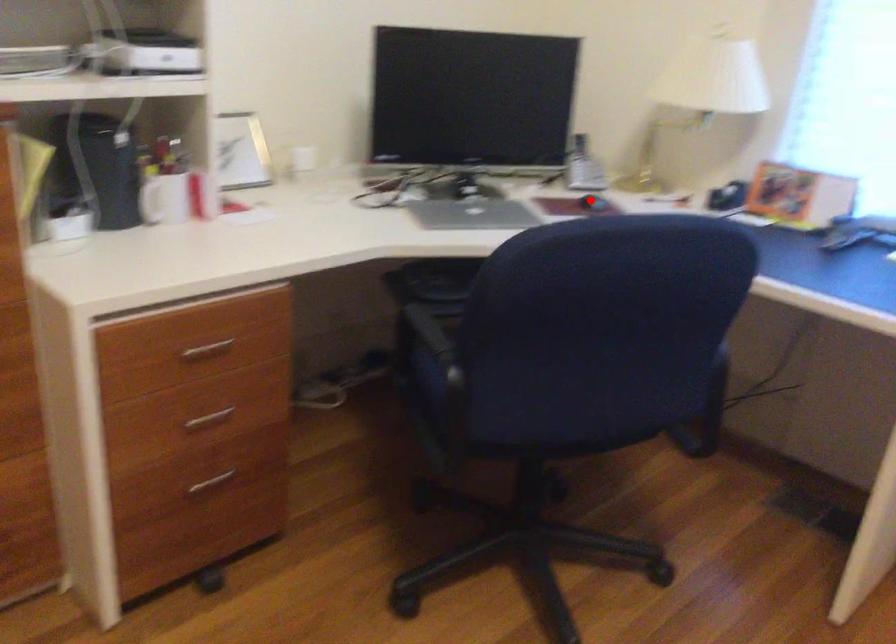
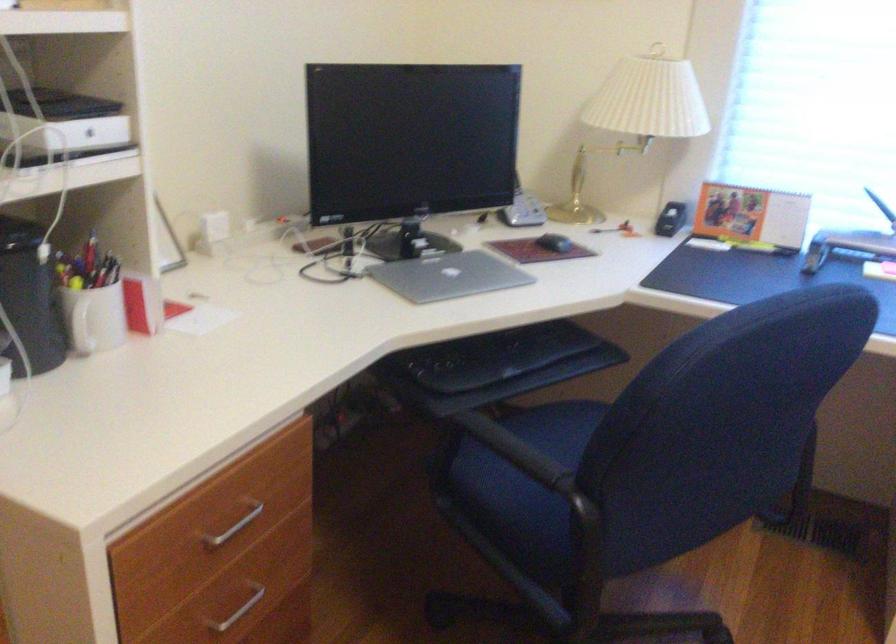
Find the pixel in the second image that matches the highlighted location in the first image.

(554, 243)